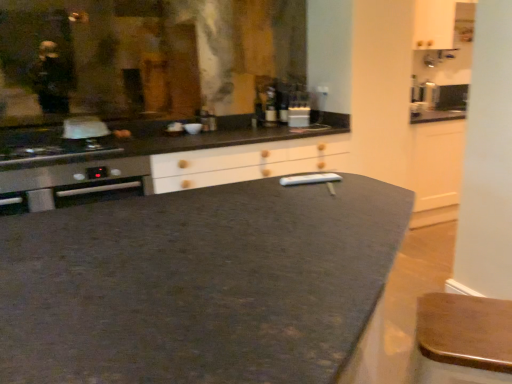
I want to click on stainless steel oven at left, so click(x=58, y=151).

The image size is (512, 384). Describe the element at coordinates (271, 107) in the screenshot. I see `matte glass bottle at center, marked as the second bottle in a right-to-left arrangement` at that location.

Locate an element on the screen. The image size is (512, 384). wooden bar stool at lower right is located at coordinates (462, 340).

Is dark granite countertop at center placed right next to wooden bar stool at lower right?

dark granite countertop at center is not next to wooden bar stool at lower right, and they're not touching.

What's the angular difference between dark granite countertop at center and wooden bar stool at lower right's facing directions?

44.7 degrees separate the facing orientations of dark granite countertop at center and wooden bar stool at lower right.

Does point (224, 293) come farther from viewer compared to point (439, 360)?

No, (224, 293) is in front of (439, 360).

Looking at this image, from a real-world perspective, is dark granite countertop at center on wooden bar stool at lower right?

Incorrect, from a real-world perspective, dark granite countertop at center is lower than wooden bar stool at lower right.

Starting from the dark granite countertop at center, which bottle is the 2nd one behind? Please provide its 2D coordinates.

[(283, 106)]

Considering the positions of objects dark granite countertop at center and matte glass bottle at center, the 2th bottle positioned from the left, in the image provided, who is more to the left, dark granite countertop at center or matte glass bottle at center, the 2th bottle positioned from the left,?

dark granite countertop at center.

Is dark granite countertop at center taller or shorter than matte glass bottle at center, placed as the first bottle when sorted from right to left?

In the image, dark granite countertop at center appears to be taller than matte glass bottle at center, placed as the first bottle when sorted from right to left.

Considering the positions of point (70, 224) and point (285, 102), is point (70, 224) closer or farther from the camera than point (285, 102)?

Point (70, 224) is closer to the camera than point (285, 102).

Could you measure the distance between matte glass bottle at center, placed as the first bottle when sorted from right to left, and stainless steel oven at left?

A distance of 5.00 feet exists between matte glass bottle at center, placed as the first bottle when sorted from right to left, and stainless steel oven at left.

Considering the relative positions of matte glass bottle at center, placed as the first bottle when sorted from right to left, and stainless steel oven at left in the image provided, is matte glass bottle at center, placed as the first bottle when sorted from right to left, to the left or to the right of stainless steel oven at left?

In the image, matte glass bottle at center, placed as the first bottle when sorted from right to left, appears on the right side of stainless steel oven at left.

From a real-world perspective, is matte glass bottle at center, the 2th bottle positioned from the left, physically above stainless steel oven at left?

Yes, from a real-world perspective, matte glass bottle at center, the 2th bottle positioned from the left, is over stainless steel oven at left

Which is more to the left, matte glass bottle at center, the first bottle when ordered from left to right, or wooden bar stool at lower right?

Positioned to the left is matte glass bottle at center, the first bottle when ordered from left to right.

Is point (271, 86) farther from camera compared to point (498, 378)?

Yes, point (271, 86) is farther from viewer.

Can you see matte glass bottle at center, marked as the second bottle in a right-to-left arrangement, touching wooden bar stool at lower right?

They are not placed beside each other.

Could you tell me if matte glass bottle at center, the first bottle when ordered from left to right, is turned towards wooden bar stool at lower right?

No, matte glass bottle at center, the first bottle when ordered from left to right, is not oriented towards wooden bar stool at lower right.

Which point is more distant from viewer, (75, 145) or (275, 102)?

The point (275, 102) is more distant.

Can you confirm if stainless steel oven at left is smaller than matte glass bottle at center, marked as the second bottle in a right-to-left arrangement?

No, stainless steel oven at left is not smaller than matte glass bottle at center, marked as the second bottle in a right-to-left arrangement.

Looking at this image, can you tell me how much stainless steel oven at left and matte glass bottle at center, the first bottle when ordered from left to right, differ in facing direction?

4 degrees.

Is stainless steel oven at left looking in the opposite direction of matte glass bottle at center, marked as the second bottle in a right-to-left arrangement?

stainless steel oven at left does not have its back to matte glass bottle at center, marked as the second bottle in a right-to-left arrangement.

From the image's perspective, is matte glass bottle at center, the first bottle when ordered from left to right, under matte glass bottle at center, placed as the first bottle when sorted from right to left?

Indeed, from the image's perspective, matte glass bottle at center, the first bottle when ordered from left to right, is shown beneath matte glass bottle at center, placed as the first bottle when sorted from right to left.

From the picture: Between matte glass bottle at center, the first bottle when ordered from left to right, and matte glass bottle at center, placed as the first bottle when sorted from right to left, which one has larger size?

matte glass bottle at center, the first bottle when ordered from left to right, is bigger.

Is matte glass bottle at center, the first bottle when ordered from left to right, positioned behind matte glass bottle at center, the 2th bottle positioned from the left?

No, it is in front of matte glass bottle at center, the 2th bottle positioned from the left.

Does matte glass bottle at center, marked as the second bottle in a right-to-left arrangement, have a lesser width compared to matte glass bottle at center, placed as the first bottle when sorted from right to left?

Incorrect, the width of matte glass bottle at center, marked as the second bottle in a right-to-left arrangement, is not less than that of matte glass bottle at center, placed as the first bottle when sorted from right to left.

Measure the distance from matte glass bottle at center, the 2th bottle positioned from the left, to wooden bar stool at lower right.

matte glass bottle at center, the 2th bottle positioned from the left, and wooden bar stool at lower right are 2.27 meters apart from each other.

Is matte glass bottle at center, placed as the first bottle when sorted from right to left, far away from wooden bar stool at lower right?

matte glass bottle at center, placed as the first bottle when sorted from right to left, is far away from wooden bar stool at lower right.

Who is taller, matte glass bottle at center, the 2th bottle positioned from the left, or wooden bar stool at lower right?

Standing taller between the two is wooden bar stool at lower right.

Consider the image. Considering the positions of objects matte glass bottle at center, the 2th bottle positioned from the left, and wooden bar stool at lower right in the image provided, who is more to the right, matte glass bottle at center, the 2th bottle positioned from the left, or wooden bar stool at lower right?

wooden bar stool at lower right is more to the right.

You are a GUI agent. You are given a task and a screenshot of the screen. Output one action in this format:
    pyautogui.click(x=<x>, y=<y>)
    Task: Click on the countertop on the left of wooden bar stool at lower right
    
    Given the screenshot: What is the action you would take?
    pyautogui.click(x=198, y=284)

Where is `countertop that appears in front of the matte glass bottle at center, the 2th bottle positioned from the left`? countertop that appears in front of the matte glass bottle at center, the 2th bottle positioned from the left is located at coordinates (198, 284).

Estimate the real-world distances between objects in this image. Which object is closer to matte glass bottle at center, marked as the second bottle in a right-to-left arrangement, stainless steel oven at left or dark granite countertop at center?

stainless steel oven at left.

Looking at this image, from the image, which object appears to be farther from matte glass bottle at center, marked as the second bottle in a right-to-left arrangement, matte glass bottle at center, the 2th bottle positioned from the left, or dark granite countertop at center?

Based on the image, dark granite countertop at center appears to be further to matte glass bottle at center, marked as the second bottle in a right-to-left arrangement.

Looking at the image, which one is located closer to matte glass bottle at center, placed as the first bottle when sorted from right to left, wooden bar stool at lower right or stainless steel oven at left?

stainless steel oven at left.

Looking at the image, which one is located further to dark granite countertop at center, matte glass bottle at center, the 2th bottle positioned from the left, or wooden bar stool at lower right?

The object further to dark granite countertop at center is matte glass bottle at center, the 2th bottle positioned from the left.

When comparing their distances from matte glass bottle at center, marked as the second bottle in a right-to-left arrangement, does matte glass bottle at center, the 2th bottle positioned from the left, or wooden bar stool at lower right seem further?

wooden bar stool at lower right is positioned further to the anchor matte glass bottle at center, marked as the second bottle in a right-to-left arrangement.

Considering their positions, is dark granite countertop at center positioned further to wooden bar stool at lower right than stainless steel oven at left?

stainless steel oven at left lies further to wooden bar stool at lower right than the other object.

Considering their positions, is stainless steel oven at left positioned further to matte glass bottle at center, the 2th bottle positioned from the left, than wooden bar stool at lower right?

The object further to matte glass bottle at center, the 2th bottle positioned from the left, is wooden bar stool at lower right.

Considering their positions, is matte glass bottle at center, placed as the first bottle when sorted from right to left, positioned further to wooden bar stool at lower right than dark granite countertop at center?

Based on the image, matte glass bottle at center, placed as the first bottle when sorted from right to left, appears to be further to wooden bar stool at lower right.

I want to click on bottle positioned between dark granite countertop at center and matte glass bottle at center, the 2th bottle positioned from the left, from near to far, so click(271, 107).

Identify the location of bar stool between dark granite countertop at center and stainless steel oven at left in the front-back direction. (462, 340).

The image size is (512, 384). What are the coordinates of `kitchen appliance between dark granite countertop at center and matte glass bottle at center, the first bottle when ordered from left to right, from front to back` in the screenshot? It's located at (58, 151).

Where is `bar stool located between dark granite countertop at center and matte glass bottle at center, the first bottle when ordered from left to right, in the depth direction`? bar stool located between dark granite countertop at center and matte glass bottle at center, the first bottle when ordered from left to right, in the depth direction is located at coordinates click(462, 340).